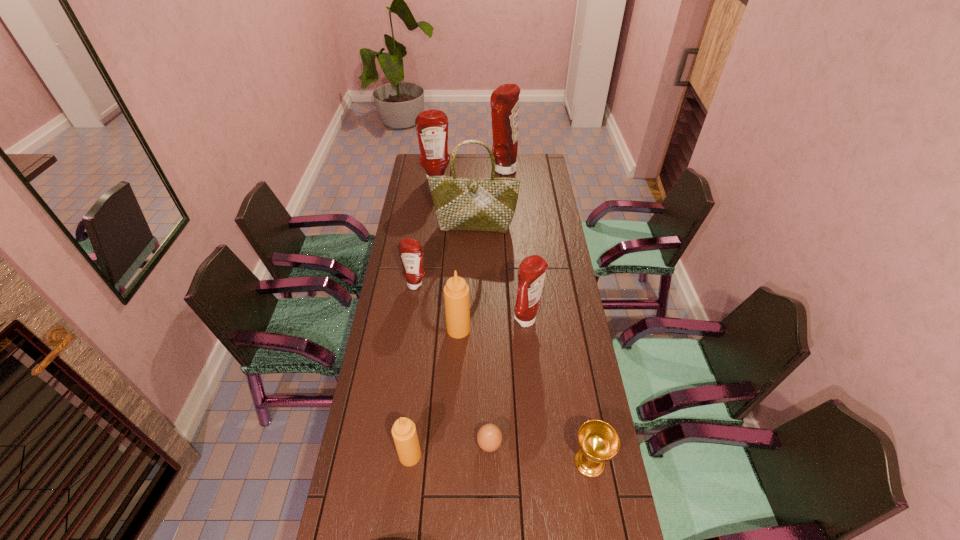
Identify which condiment is located as the nearest to the tallest condiment. Please provide its 2D coordinates. Your answer should be formatted as a tuple, i.e. [(x, y)], where the tuple contains the x and y coordinates of a point satisfying the conditions above.

[(432, 125)]

The height and width of the screenshot is (540, 960). Identify the location of the second closest condiment to the smaller tan condiment. tap(532, 270).

The width and height of the screenshot is (960, 540). What are the coordinates of `red condiment that is the closest one to the seventh nearest object` in the screenshot? It's located at (432, 125).

Identify which red condiment is the third nearest to the seventh nearest object. Please provide its 2D coordinates. Your answer should be formatted as a tuple, i.e. [(x, y)], where the tuple contains the x and y coordinates of a point satisfying the conditions above.

[(504, 100)]

Locate an element on the screen. This screenshot has height=540, width=960. free location that satisfies the following two spatial constraints: 1. on the front side of the bigger tan condiment; 2. on the right side of the third farthest condiment is located at coordinates (409, 329).

Identify the location of free location that satisfies the following two spatial constraints: 1. on the back side of the smaller tan condiment; 2. on the left side of the bigger tan condiment. (424, 329).